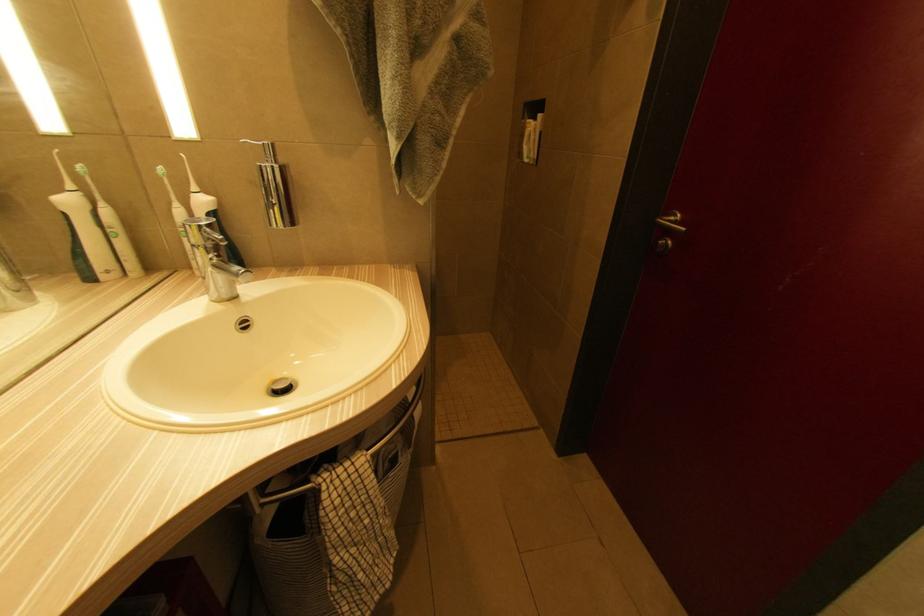
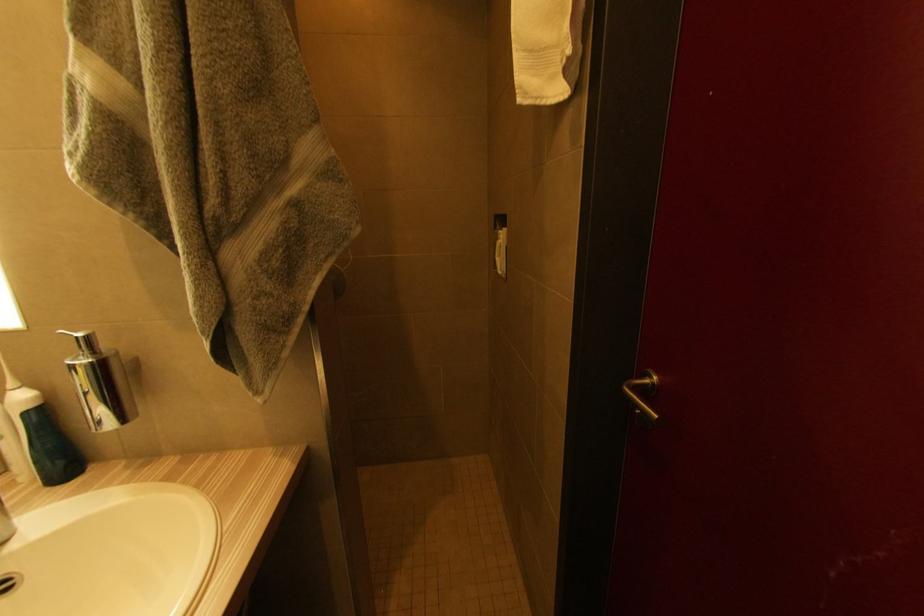
Question: How did the camera likely rotate?

Choices:
 (A) Left
 (B) Right
 (C) Up
 (D) Down

Answer: (C)